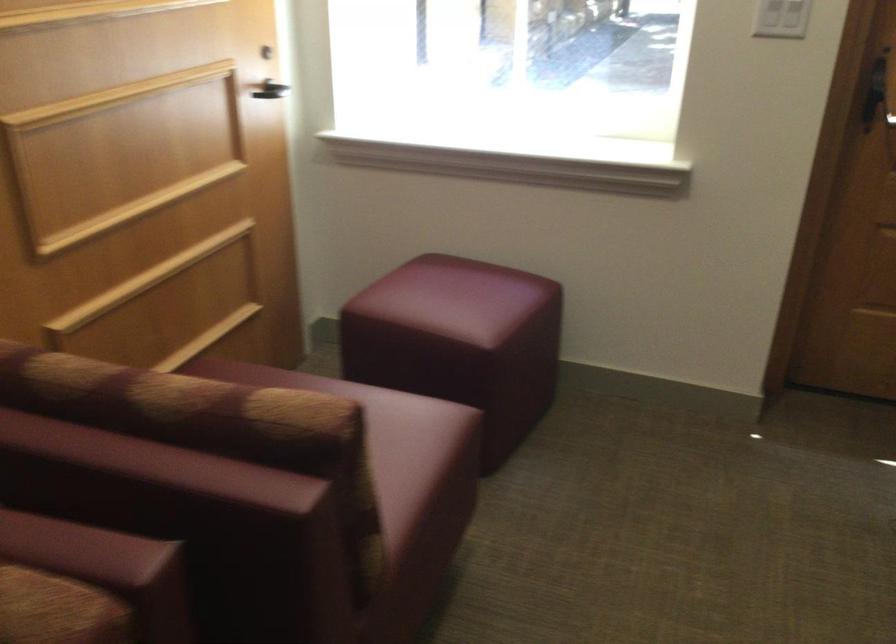
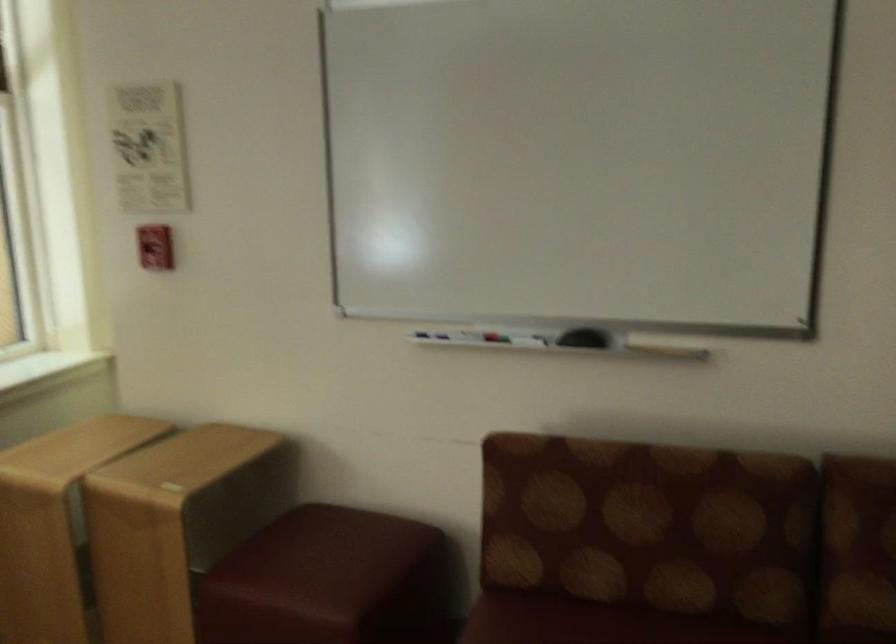
Question: Based on the continuous images, in which direction is the camera rotating? Reply with the corresponding letter.

Choices:
 (A) Left
 (B) Right
 (C) Up
 (D) Down

Answer: (B)